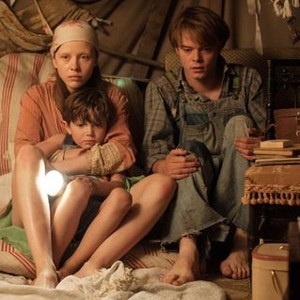
Find the location of a particular element. The height and width of the screenshot is (300, 300). red striped area on the back of the cushion to the left side is located at coordinates (8, 91).